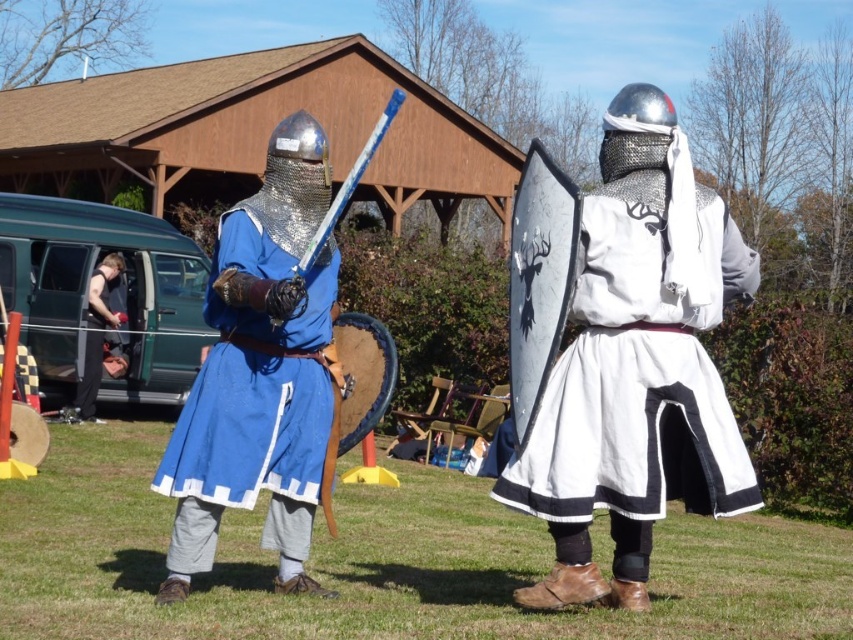
You are a medieval scribe observing a mock battle between two armored figures. You notice a specific point in the image at coordinates (260, 372). What object is located at this point?

The point at coordinates (260, 372) indicates the matte blue tunic at center.